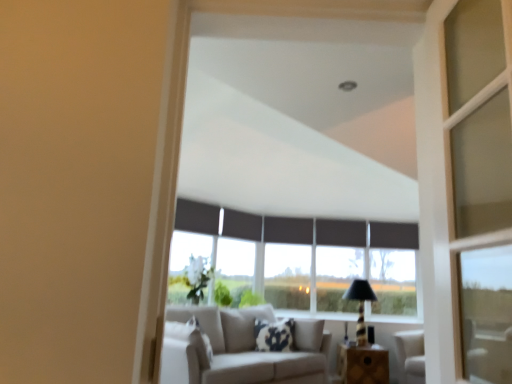
You are a GUI agent. You are given a task and a screenshot of the screen. Output one action in this format:
    pyautogui.click(x=<x>, y=<y>)
    Task: Click on the wooden table at lower center
    The image size is (512, 384).
    Given the screenshot: What is the action you would take?
    pyautogui.click(x=362, y=364)

The height and width of the screenshot is (384, 512). What do you see at coordinates (394, 235) in the screenshot? I see `dark matte curtain at center, which ranks as the first curtain in right-to-left order` at bounding box center [394, 235].

What do you see at coordinates (341, 233) in the screenshot?
I see `black fabric curtain at center, marked as the 4th curtain in a left-to-right arrangement` at bounding box center [341, 233].

Locate an element on the screen. wooden table at lower center is located at coordinates (362, 364).

In the scene shown: From a real-world perspective, between dark matte curtain at center, which ranks as the first curtain in back-to-front order, and black fabric curtain at center, marked as the 4th curtain in a left-to-right arrangement, who is vertically higher?

dark matte curtain at center, which ranks as the first curtain in back-to-front order, is physically above.

Is dark matte curtain at center, the fifth curtain viewed from the front, positioned before black fabric curtain at center, placed as the second curtain when sorted from right to left?

No, dark matte curtain at center, the fifth curtain viewed from the front, is behind black fabric curtain at center, placed as the second curtain when sorted from right to left.

Who is taller, dark matte curtain at center, the fifth curtain viewed from the front, or black fabric curtain at center, which ranks as the fourth curtain in front-to-back order?

With more height is dark matte curtain at center, the fifth curtain viewed from the front.

Starting from the dark matte curtain at center, which appears as the fifth curtain when viewed from the left, which curtain is the 1st one in front? Please provide its 2D coordinates.

[(341, 233)]

Does dark gray fabric curtain at center, which appears as the third curtain when viewed from the front, turn towards black fabric curtain at center, the 2th curtain when ordered from left to right?

No, dark gray fabric curtain at center, which appears as the third curtain when viewed from the front, is not turned towards black fabric curtain at center, the 2th curtain when ordered from left to right.

From the image's perspective, which is below, dark gray fabric curtain at center, the 3th curtain when ordered from right to left, or black fabric curtain at center, the 2th curtain when ordered from left to right?

dark gray fabric curtain at center, the 3th curtain when ordered from right to left, appears lower in the image.

Does dark gray fabric curtain at center, acting as the third curtain starting from the back, lie behind black fabric curtain at center, the 2th curtain when ordered from left to right?

Yes.

Considering the relative sizes of fluffy white pillow at center and dark matte curtain at center, which ranks as the first curtain in back-to-front order, in the image provided, is fluffy white pillow at center wider than dark matte curtain at center, which ranks as the first curtain in back-to-front order,?

Yes.

Between fluffy white pillow at center and dark matte curtain at center, which ranks as the first curtain in right-to-left order, which one appears on the left side from the viewer's perspective?

fluffy white pillow at center.

Is fluffy white pillow at center not close to dark matte curtain at center, which ranks as the first curtain in back-to-front order?

Yes, fluffy white pillow at center and dark matte curtain at center, which ranks as the first curtain in back-to-front order, are quite far apart.

From a real-world perspective, is wooden table at lower center physically below black fabric curtain at center, the 4th curtain in the back-to-front sequence?

Indeed, from a real-world perspective, wooden table at lower center is positioned beneath black fabric curtain at center, the 4th curtain in the back-to-front sequence.

From their relative heights in the image, would you say wooden table at lower center is taller or shorter than black fabric curtain at center, which is the fourth curtain in right-to-left order?

Clearly, wooden table at lower center is taller compared to black fabric curtain at center, which is the fourth curtain in right-to-left order.

The image size is (512, 384). I want to click on table lying in front of the black fabric curtain at center, the 2th curtain when ordered from left to right, so click(x=362, y=364).

Considering their positions, is black fabric curtain at center, which appears as the second curtain when viewed from the front, located in front of or behind dark gray fabric curtain at center, which appears as the third curtain when viewed from the front?

Clearly, black fabric curtain at center, which appears as the second curtain when viewed from the front, is in front of dark gray fabric curtain at center, which appears as the third curtain when viewed from the front.

Who is bigger, black fabric curtain at center, the 2th curtain when ordered from left to right, or dark gray fabric curtain at center, which appears as the 3th curtain when viewed from the left?

Bigger between the two is black fabric curtain at center, the 2th curtain when ordered from left to right.

Which is nearer, (254, 224) or (267, 223)?

Point (254, 224) is positioned closer to the camera compared to point (267, 223).

Looking at their sizes, would you say black fabric curtain at center, which is the fourth curtain in right-to-left order, is wider or thinner than dark gray fabric curtain at center, which appears as the third curtain when viewed from the front?

Considering their sizes, black fabric curtain at center, which is the fourth curtain in right-to-left order, looks broader than dark gray fabric curtain at center, which appears as the third curtain when viewed from the front.

Between black textured table lamp at center and fluffy white pillow at center, which one has smaller width?

fluffy white pillow at center is thinner.

Does black textured table lamp at center have a lesser height compared to fluffy white pillow at center?

No, black textured table lamp at center is not shorter than fluffy white pillow at center.

From the image's perspective, which is above, black textured table lamp at center or fluffy white pillow at center?

From the image's view, black textured table lamp at center is above.

From a real-world perspective, is black textured table lamp at center on fluffy white pillow at center?

Indeed, from a real-world perspective, black textured table lamp at center stands above fluffy white pillow at center.

How different are the orientations of black fabric curtain at center, the second curtain viewed from the back, and black fabric curtain at upper center, which is counted as the first curtain, starting from the left, in degrees?

44.5 degrees.

Considering their positions, is black fabric curtain at center, the second curtain viewed from the back, located in front of or behind black fabric curtain at upper center, arranged as the fifth curtain when viewed from the back?

black fabric curtain at center, the second curtain viewed from the back, is positioned farther from the viewer than black fabric curtain at upper center, arranged as the fifth curtain when viewed from the back.

Is black fabric curtain at center, placed as the second curtain when sorted from right to left, shorter than black fabric curtain at upper center, arranged as the fifth curtain when viewed from the back?

Yes, black fabric curtain at center, placed as the second curtain when sorted from right to left, is shorter than black fabric curtain at upper center, arranged as the fifth curtain when viewed from the back.

Between black fabric curtain at center, the second curtain viewed from the back, and black fabric curtain at upper center, which ranks as the 5th curtain in right-to-left order, which one has smaller width?

Thinner between the two is black fabric curtain at center, the second curtain viewed from the back.

Locate an element on the screen. This screenshot has height=384, width=512. the 1st curtain above when counting from the dark matte curtain at center, the fifth curtain viewed from the front (from the image's perspective) is located at coordinates (341, 233).

Where is `the 1st curtain in front when counting from the dark gray fabric curtain at center, the 3th curtain when ordered from right to left`? the 1st curtain in front when counting from the dark gray fabric curtain at center, the 3th curtain when ordered from right to left is located at coordinates (241, 225).

Estimate the real-world distances between objects in this image. Which object is further from beige fabric armchair at lower right, black textured table lamp at center or black fabric curtain at upper center, arranged as the fifth curtain when viewed from the back?

Based on the image, black fabric curtain at upper center, arranged as the fifth curtain when viewed from the back, appears to be further to beige fabric armchair at lower right.

Which object lies further to the anchor point wooden table at lower center, fluffy white pillow at center or black fabric curtain at upper center, arranged as the fifth curtain when viewed from the back?

black fabric curtain at upper center, arranged as the fifth curtain when viewed from the back.

Estimate the real-world distances between objects in this image. Which object is further from black fabric curtain at center, the 4th curtain in the back-to-front sequence, black textured table lamp at center or black fabric curtain at center, marked as the 4th curtain in a left-to-right arrangement?

black textured table lamp at center lies further to black fabric curtain at center, the 4th curtain in the back-to-front sequence, than the other object.

Estimate the real-world distances between objects in this image. Which object is closer to fluffy white pillow at center, black fabric curtain at center, which ranks as the fourth curtain in front-to-back order, or black textured table lamp at center?

Based on the image, black textured table lamp at center appears to be nearer to fluffy white pillow at center.

Which object lies further to the anchor point black fabric curtain at center, which appears as the second curtain when viewed from the front, black textured table lamp at center or fluffy white pillow at center?

Among the two, black textured table lamp at center is located further to black fabric curtain at center, which appears as the second curtain when viewed from the front.

From the image, which object appears to be nearer to black fabric curtain at upper center, which ranks as the 5th curtain in right-to-left order, beige fabric armchair at lower right or dark matte curtain at center, which ranks as the first curtain in right-to-left order?

dark matte curtain at center, which ranks as the first curtain in right-to-left order.

Estimate the real-world distances between objects in this image. Which object is further from dark matte curtain at center, the fifth curtain viewed from the front, black fabric curtain at center, the 2th curtain when ordered from left to right, or fluffy white pillow at center?

fluffy white pillow at center.

Based on their spatial positions, is beige fabric armchair at lower right or black fabric curtain at center, which ranks as the fourth curtain in front-to-back order, closer to wooden table at lower center?

beige fabric armchair at lower right lies closer to wooden table at lower center than the other object.

This screenshot has width=512, height=384. I want to click on table lamp between beige fabric armchair at lower right and dark matte curtain at center, which appears as the fifth curtain when viewed from the left, along the z-axis, so click(x=360, y=305).

This screenshot has width=512, height=384. I want to click on table lamp between fluffy white pillow at center and dark gray fabric curtain at center, the 3th curtain when ordered from right to left, from front to back, so click(360, 305).

Find the location of a particular element. The image size is (512, 384). table lamp situated between dark gray fabric curtain at center, acting as the third curtain starting from the back, and dark matte curtain at center, which ranks as the first curtain in right-to-left order, from left to right is located at coordinates (360, 305).

Locate an element on the screen. This screenshot has width=512, height=384. table lamp that lies between black fabric curtain at center, the second curtain viewed from the back, and wooden table at lower center from top to bottom is located at coordinates (360, 305).